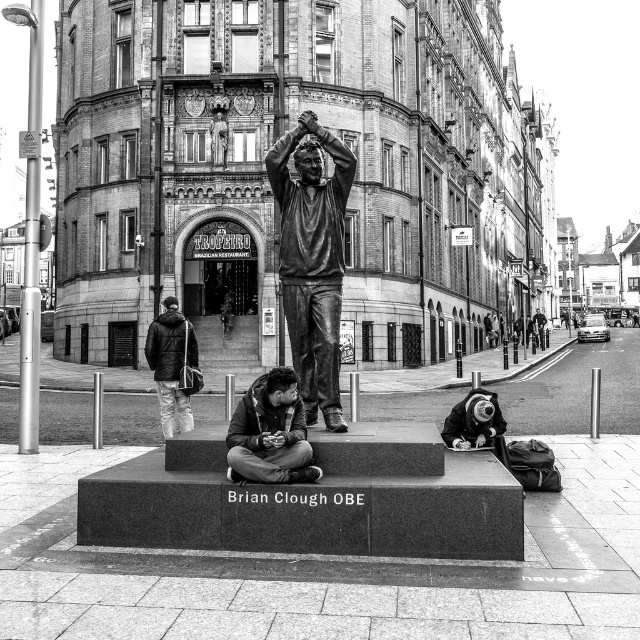
Based on the scene description, can you determine if the bronze statue at center is positioned higher than the dark brown leather jacket at center?

Yes, the bronze statue at center is above the dark brown leather jacket at center according to the description.

Based on the scene description, where is the dark brown leather jacket at center located in terms of coordinates?

The dark brown leather jacket at center is located at coordinates point (269, 433).

You are standing in the public square and want to take a photo of the bronze statue at center. To ensure the statue is the main focus, where should you position yourself relative to the statue?

The bronze statue at center is located at point (x=312, y=259), so positioning yourself directly in front of the statue at its central coordinates would ensure it remains the main focus in your photo.